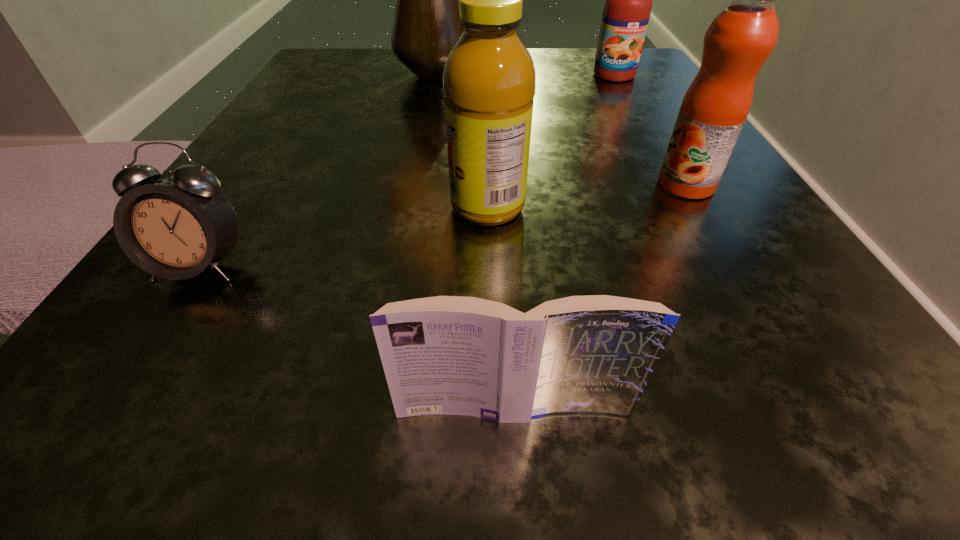
Select which object appears as the closest to the lampshade. Please provide its 2D coordinates. Your answer should be formatted as a tuple, i.e. [(x, y)], where the tuple contains the x and y coordinates of a point satisfying the conditions above.

[(627, 9)]

Identify which object is the fourth closest to the lampshade. Please provide its 2D coordinates. Your answer should be formatted as a tuple, i.e. [(x, y)], where the tuple contains the x and y coordinates of a point satisfying the conditions above.

[(176, 228)]

Locate an element on the screen. fruit juice that is the second closest to the leftmost fruit juice is located at coordinates (627, 9).

Locate an element on the screen. Image resolution: width=960 pixels, height=540 pixels. fruit juice that is the closest one to the leftmost fruit juice is located at coordinates (739, 40).